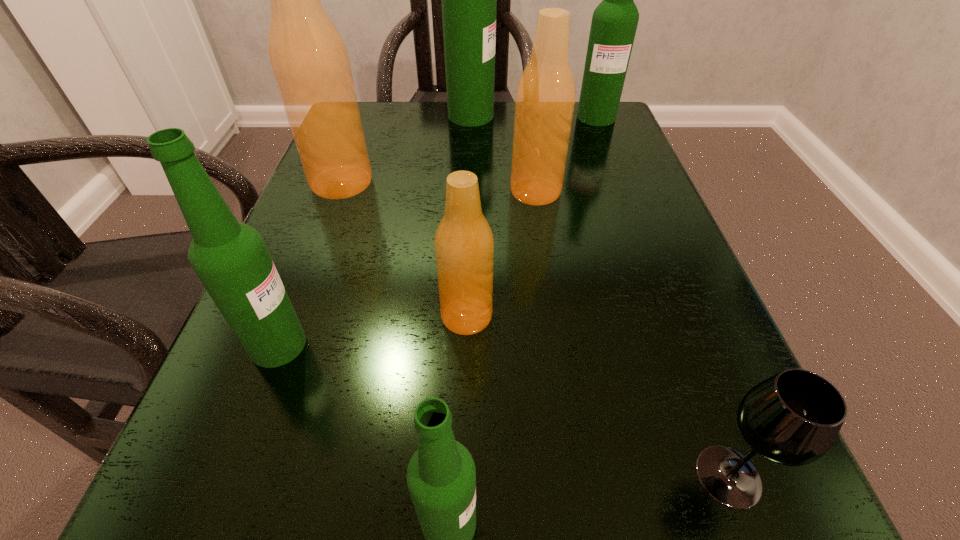
Locate an element on the screen. This screenshot has height=540, width=960. the biggest green beer bottle is located at coordinates (469, 0).

Locate an element on the screen. This screenshot has width=960, height=540. the tallest beer bottle is located at coordinates [469, 0].

You are a GUI agent. You are given a task and a screenshot of the screen. Output one action in this format:
    pyautogui.click(x=<x>, y=<y>)
    Task: Click on the third smallest green beer bottle
    The image size is (960, 540).
    Given the screenshot: What is the action you would take?
    pyautogui.click(x=614, y=23)

Find the location of a particular element. This screenshot has height=540, width=960. the rightmost green beer bottle is located at coordinates pyautogui.click(x=614, y=23).

Identify the location of the leftmost tan beer bottle. (308, 57).

At what (x,y) coordinates should I click in order to perform the action: click on the second biggest tan beer bottle. Please return your answer as a coordinate pair (x, y). The image size is (960, 540). Looking at the image, I should click on (545, 97).

I want to click on the third object from right to left, so click(545, 97).

Find the location of `the leftmost green beer bottle`. the leftmost green beer bottle is located at coordinates (230, 258).

At what (x,y) coordinates should I click in order to perform the action: click on the second smallest green beer bottle. Please return your answer as a coordinate pair (x, y). The image size is (960, 540). Looking at the image, I should click on (230, 258).

Identify the location of the second tan beer bottle from right to left. (464, 244).